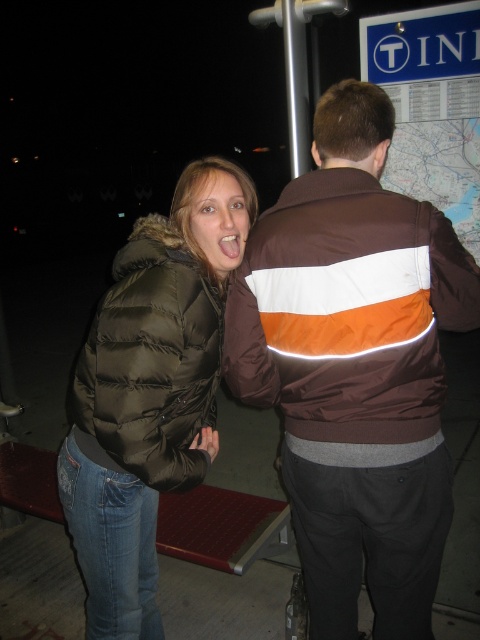
You are a photographer trying to decide which jacket to focus on for a closeup shot. Given that the matte black puffer jacket at left and the dark green puffer jacket at left are both in the frame, which one would you choose if you want to capture more details without zooming in further?

The matte black puffer jacket at left is larger in size than the dark green puffer jacket at left, so choosing the matte black puffer jacket at left would allow you to capture more details without needing to zoom in further.